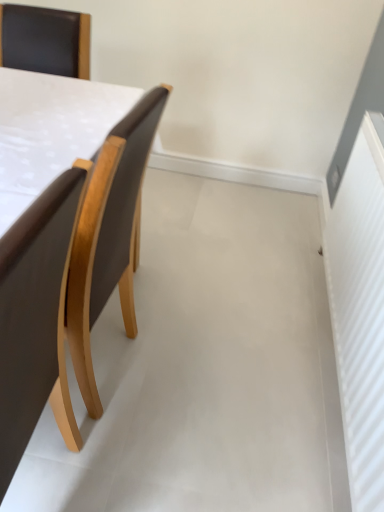
Question: Is brown leather chair at left, the 2th chair from the back, smaller than brown leather chair at left, marked as the 2th chair in a front-to-back arrangement?

Choices:
 (A) no
 (B) yes

Answer: (B)

Question: Does brown leather chair at left, which ranks as the 1th chair in front-to-back order, contain brown leather chair at left, which ranks as the first chair in back-to-front order?

Choices:
 (A) no
 (B) yes

Answer: (A)

Question: Is brown leather chair at left, the 2th chair from the back, positioned behind brown leather chair at left, which ranks as the first chair in back-to-front order?

Choices:
 (A) yes
 (B) no

Answer: (B)

Question: From the image's perspective, is brown leather chair at left, the 2th chair from the back, below brown leather chair at left, which ranks as the first chair in back-to-front order?

Choices:
 (A) no
 (B) yes

Answer: (B)

Question: Is brown leather chair at left, the 2th chair from the back, taller than brown leather chair at left, marked as the 2th chair in a front-to-back arrangement?

Choices:
 (A) yes
 (B) no

Answer: (A)

Question: Is brown leather chair at left, which ranks as the 1th chair in front-to-back order, to the left of brown leather chair at left, which ranks as the first chair in back-to-front order, from the viewer's perspective?

Choices:
 (A) no
 (B) yes

Answer: (B)

Question: Is brown leather chair at left, which ranks as the first chair in back-to-front order, positioned far away from brown leather chair at left, which ranks as the 1th chair in front-to-back order?

Choices:
 (A) no
 (B) yes

Answer: (A)

Question: Could you tell me if brown leather chair at left, which ranks as the first chair in back-to-front order, is turned towards brown leather chair at left, the 2th chair from the back?

Choices:
 (A) no
 (B) yes

Answer: (A)

Question: Considering the relative positions of brown leather chair at left, marked as the 2th chair in a front-to-back arrangement, and brown leather chair at left, the 2th chair from the back, in the image provided, is brown leather chair at left, marked as the 2th chair in a front-to-back arrangement, behind brown leather chair at left, the 2th chair from the back,?

Choices:
 (A) no
 (B) yes

Answer: (B)

Question: Is brown leather chair at left, which ranks as the first chair in back-to-front order, smaller than brown leather chair at left, which ranks as the 1th chair in front-to-back order?

Choices:
 (A) no
 (B) yes

Answer: (A)

Question: From a real-world perspective, is brown leather chair at left, marked as the 2th chair in a front-to-back arrangement, physically below brown leather chair at left, the 2th chair from the back?

Choices:
 (A) no
 (B) yes

Answer: (B)

Question: From the image's perspective, would you say brown leather chair at left, marked as the 2th chair in a front-to-back arrangement, is shown under brown leather chair at left, the 2th chair from the back?

Choices:
 (A) no
 (B) yes

Answer: (A)

Question: Is brown leather chair at left, which ranks as the 1th chair in front-to-back order, taller or shorter than brown leather chair at left, marked as the 2th chair in a front-to-back arrangement?

Choices:
 (A) tall
 (B) short

Answer: (A)